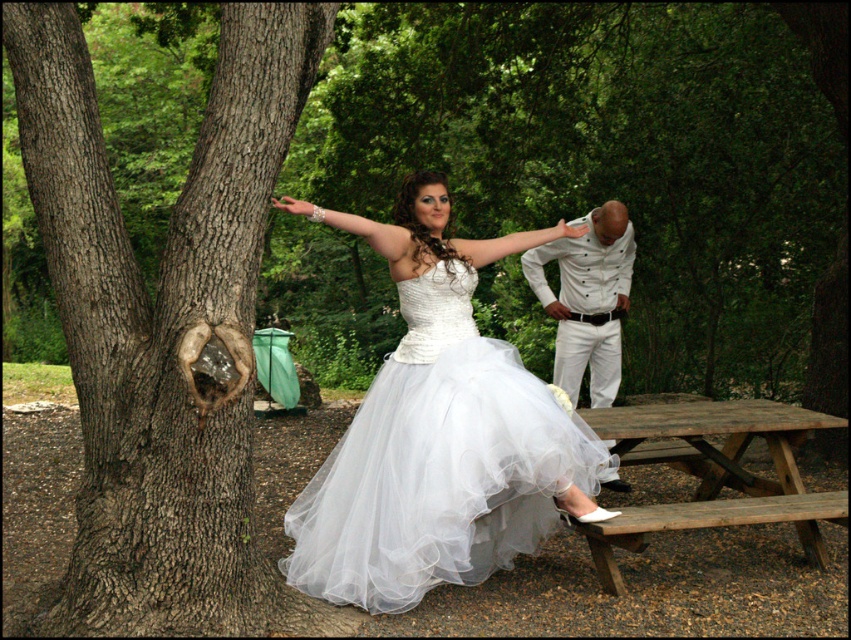
You are planning to set up a small picnic for two people. Given the space occupied by the brown rough bark tree at left and the wooden picnic table at lower right, which object would be more suitable to place the picnic blanket under?

The wooden picnic table at lower right is more suitable to place the picnic blanket under because it occupies more space than the brown rough bark tree at left.

You are a photographer setting up for a photoshoot. You need to place a large camera bag that requires 1.5 square meters of space. You see the wooden picnic table at lower right and the white textured shirt at center. Which object can accommodate the camera bag?

The wooden picnic table at lower right is bigger than the white textured shirt at center, so the wooden picnic table at lower right can accommodate the camera bag as it has enough space.